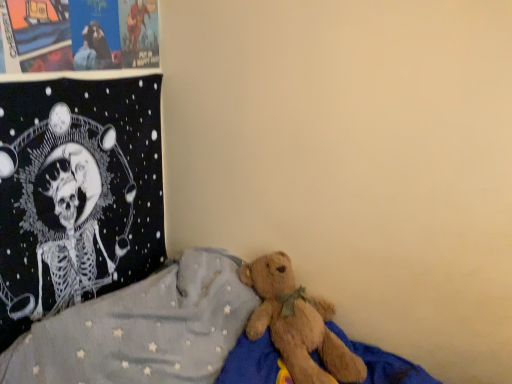
Question: Can you confirm if black fabric tapestry at upper left is positioned to the left of brown plush bear at lower right?

Choices:
 (A) yes
 (B) no

Answer: (A)

Question: Is black fabric tapestry at upper left facing towards brown plush bear at lower right?

Choices:
 (A) yes
 (B) no

Answer: (A)

Question: From the image's perspective, is black fabric tapestry at upper left beneath brown plush bear at lower right?

Choices:
 (A) yes
 (B) no

Answer: (B)

Question: Does black fabric tapestry at upper left have a greater height compared to brown plush bear at lower right?

Choices:
 (A) yes
 (B) no

Answer: (A)

Question: Can you confirm if black fabric tapestry at upper left is thinner than brown plush bear at lower right?

Choices:
 (A) yes
 (B) no

Answer: (A)

Question: Considering the positions of brown plush bear at lower right and matte paper posters at upper left in the image, is brown plush bear at lower right wider or thinner than matte paper posters at upper left?

Choices:
 (A) wide
 (B) thin

Answer: (A)

Question: Considering their positions, is brown plush bear at lower right located in front of or behind matte paper posters at upper left?

Choices:
 (A) front
 (B) behind

Answer: (A)

Question: Is brown plush bear at lower right spatially inside matte paper posters at upper left, or outside of it?

Choices:
 (A) inside
 (B) outside

Answer: (B)

Question: From their relative heights in the image, would you say brown plush bear at lower right is taller or shorter than matte paper posters at upper left?

Choices:
 (A) tall
 (B) short

Answer: (A)

Question: Is matte paper posters at upper left spatially inside brown plush bear at lower right, or outside of it?

Choices:
 (A) outside
 (B) inside

Answer: (A)

Question: From a real-world perspective, is matte paper posters at upper left positioned above or below brown plush bear at lower right?

Choices:
 (A) below
 (B) above

Answer: (B)

Question: Is matte paper posters at upper left to the left or to the right of brown plush bear at lower right in the image?

Choices:
 (A) right
 (B) left

Answer: (B)

Question: Considering their positions, is matte paper posters at upper left located in front of or behind brown plush bear at lower right?

Choices:
 (A) behind
 (B) front

Answer: (A)

Question: Looking at their shapes, would you say black fabric tapestry at upper left is wider or thinner than brown plush bear at lower right?

Choices:
 (A) wide
 (B) thin

Answer: (B)

Question: In terms of height, does black fabric tapestry at upper left look taller or shorter compared to brown plush bear at lower right?

Choices:
 (A) tall
 (B) short

Answer: (A)